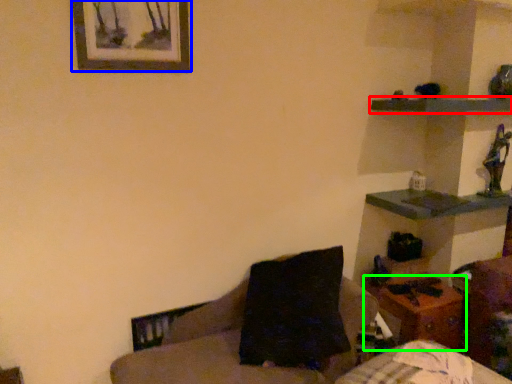
Question: Which object is the farthest from shelf (highlighted by a red box)? Choose among these: picture frame (highlighted by a blue box) or table (highlighted by a green box).

Choices:
 (A) picture frame
 (B) table

Answer: (A)